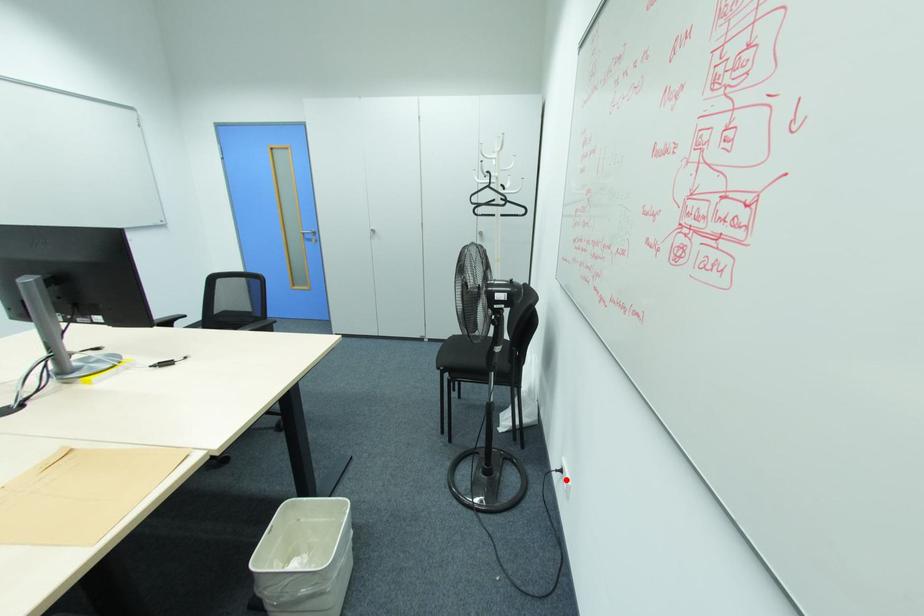
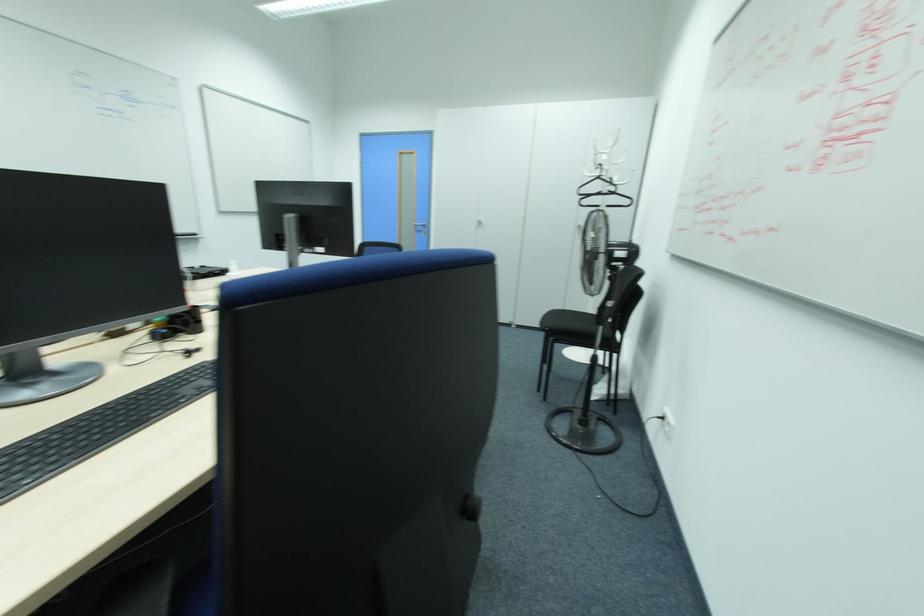
In the second image, find the point that corresponds to the highlighted location in the first image.

(670, 424)